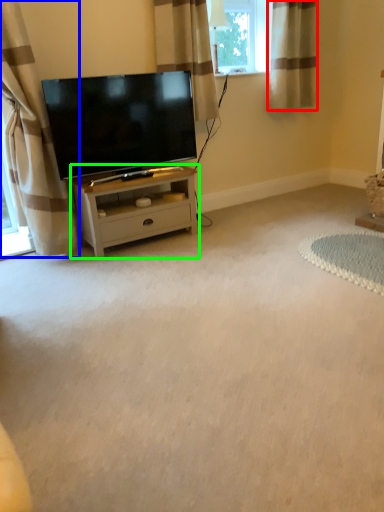
Question: Estimate the real-world distances between objects in this image. Which object is farther from curtain (highlighted by a red box), curtain (highlighted by a blue box) or nightstand (highlighted by a green box)?

Choices:
 (A) curtain
 (B) nightstand

Answer: (A)